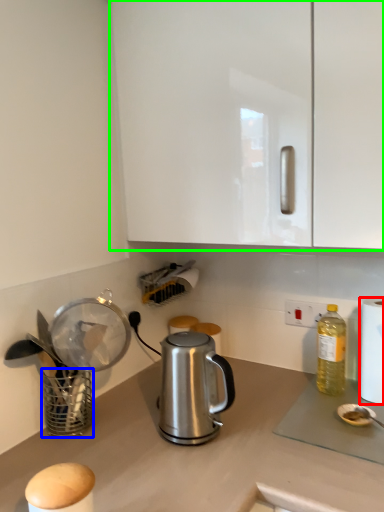
Question: Which object is the closest to the paper towel (highlighted by a red box)? Choose among these: basket (highlighted by a blue box) or cabinetry (highlighted by a green box).

Choices:
 (A) basket
 (B) cabinetry

Answer: (B)